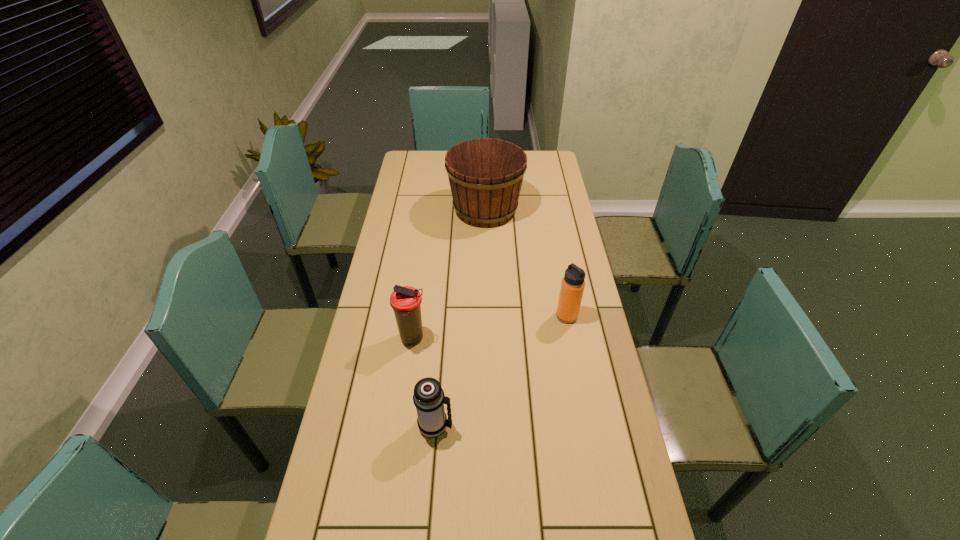
At what (x,y) coordinates should I click in order to perform the action: click on vacant area between the nearest thermos bottle and the farthest object. Please return your answer as a coordinate pair (x, y). This screenshot has width=960, height=540. Looking at the image, I should click on (461, 318).

This screenshot has height=540, width=960. I want to click on vacant point located between the second farthest thermos bottle and the wine bucket, so click(449, 274).

The width and height of the screenshot is (960, 540). In order to click on unoccupied position between the second farthest thermos bottle and the farthest thermos bottle in this screenshot , I will do `click(490, 327)`.

Locate an element on the screen. vacant area that lies between the second nearest thermos bottle and the third nearest object is located at coordinates (490, 327).

At what (x,y) coordinates should I click in order to perform the action: click on unoccupied position between the rightmost object and the wine bucket. Please return your answer as a coordinate pair (x, y). This screenshot has width=960, height=540. Looking at the image, I should click on (526, 263).

Select which object appears as the closest to the second nearest object. Please provide its 2D coordinates. Your answer should be formatted as a tuple, i.e. [(x, y)], where the tuple contains the x and y coordinates of a point satisfying the conditions above.

[(429, 399)]

You are a GUI agent. You are given a task and a screenshot of the screen. Output one action in this format:
    pyautogui.click(x=<x>, y=<y>)
    Task: Click on the closest object to the second farthest thermos bottle
    
    Given the screenshot: What is the action you would take?
    pyautogui.click(x=429, y=399)

Point out which thermos bottle is positioned as the nearest to the rightmost object. Please provide its 2D coordinates. Your answer should be formatted as a tuple, i.e. [(x, y)], where the tuple contains the x and y coordinates of a point satisfying the conditions above.

[(405, 301)]

This screenshot has width=960, height=540. I want to click on thermos bottle object that ranks as the closest to the second nearest thermos bottle, so click(x=429, y=399).

At what (x,y) coordinates should I click in order to perform the action: click on free space that satisfies the following two spatial constraints: 1. on the back side of the third farthest object; 2. on the left side of the second farthest object. Please return your answer as a coordinate pair (x, y). Looking at the image, I should click on (416, 316).